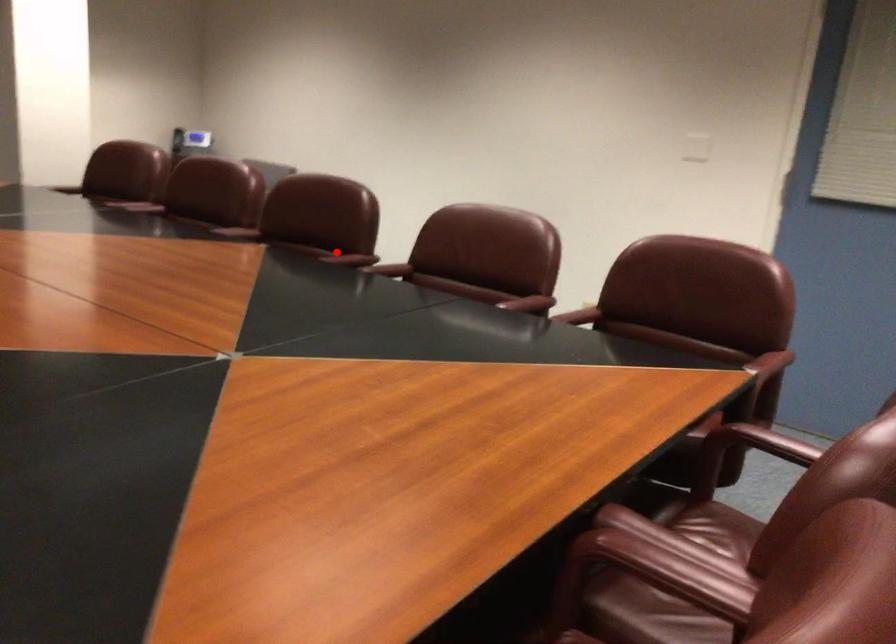
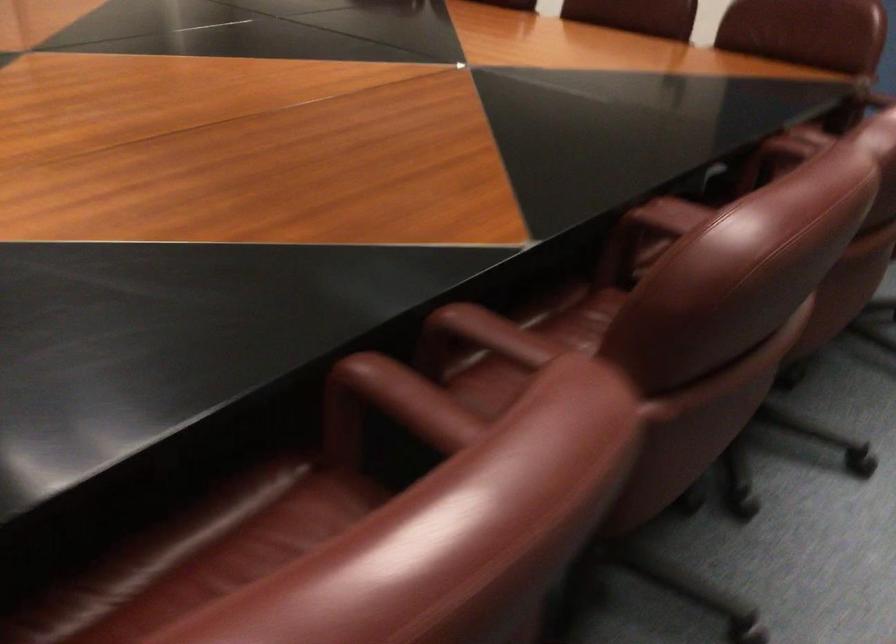
Question: I am providing you with two images of the same scene from different viewpoints. In image1, a red point is highlighted. Considering the same 3D point in image2, which of the following is correct?

Choices:
 (A) It is closer
 (B) It is farther

Answer: (A)